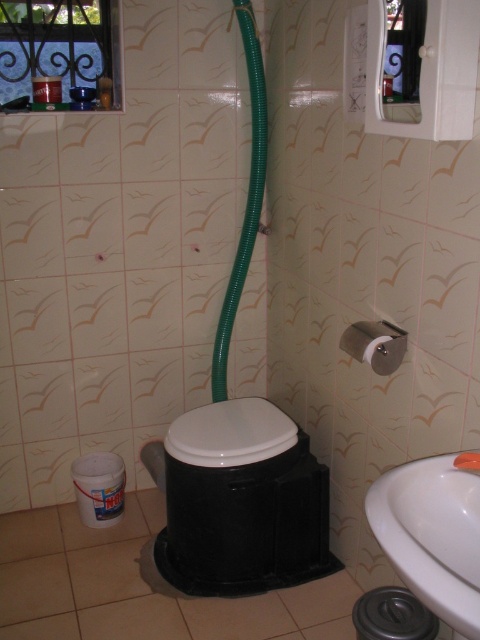
Does white matte toilet lid at center have a larger size compared to green rubber hose at center?

No.

Who is lower down, white matte toilet lid at center or green rubber hose at center?

white matte toilet lid at center is lower down.

Locate an element on the screen. The width and height of the screenshot is (480, 640). white matte toilet lid at center is located at coordinates (230, 433).

I want to click on white matte toilet lid at center, so click(230, 433).

I want to click on white glossy sink at lower right, so click(432, 536).

Between white glossy sink at lower right and green rubber hose at center, which one appears on the left side from the viewer's perspective?

From the viewer's perspective, green rubber hose at center appears more on the left side.

Is point (418, 493) closer to viewer compared to point (262, 68)?

Yes, it is in front of point (262, 68).

Where is `white glossy sink at lower right`? The width and height of the screenshot is (480, 640). white glossy sink at lower right is located at coordinates (432, 536).

In the scene shown: Which is below, black plastic toilet at lower center or white glossy sink at lower right?

black plastic toilet at lower center is lower down.

Does black plastic toilet at lower center have a greater width compared to white glossy sink at lower right?

Yes.

Which is behind, point (289, 577) or point (420, 596)?

Point (289, 577)

Locate an element on the screen. This screenshot has height=640, width=480. black plastic toilet at lower center is located at coordinates (241, 500).